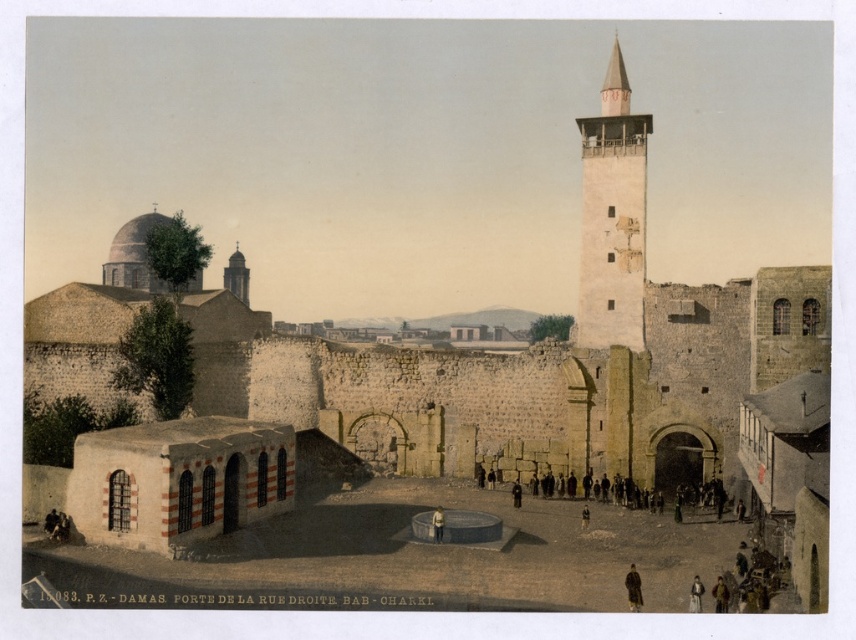
Looking at this image, is smooth stone minaret at upper left positioned in front of brown leather jacket at lower right?

No, smooth stone minaret at upper left is further to the viewer.

Locate an element on the screen. The height and width of the screenshot is (640, 856). smooth stone minaret at upper left is located at coordinates (x=236, y=275).

Between white stone tower at upper right and brown fur coat at lower right, which one has more height?

white stone tower at upper right is taller.

Is white stone tower at upper right in front of brown fur coat at lower right?

No, white stone tower at upper right is behind brown fur coat at lower right.

Locate an element on the screen. The width and height of the screenshot is (856, 640). white stone tower at upper right is located at coordinates (611, 216).

Identify the location of white stone tower at upper right. (611, 216).

Where is `white stone tower at upper right`? This screenshot has width=856, height=640. white stone tower at upper right is located at coordinates (611, 216).

Which of these two, white stone tower at upper right or light brown leather jacket at center, stands taller?

Standing taller between the two is white stone tower at upper right.

This screenshot has width=856, height=640. Describe the element at coordinates (611, 216) in the screenshot. I see `white stone tower at upper right` at that location.

Locate an element on the screen. The height and width of the screenshot is (640, 856). white stone tower at upper right is located at coordinates (611, 216).